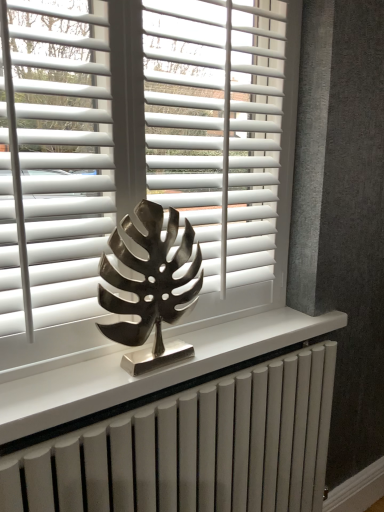
Where is `spots to the right of metallic leaf sculpture at center`? Image resolution: width=384 pixels, height=512 pixels. spots to the right of metallic leaf sculpture at center is located at coordinates (214, 349).